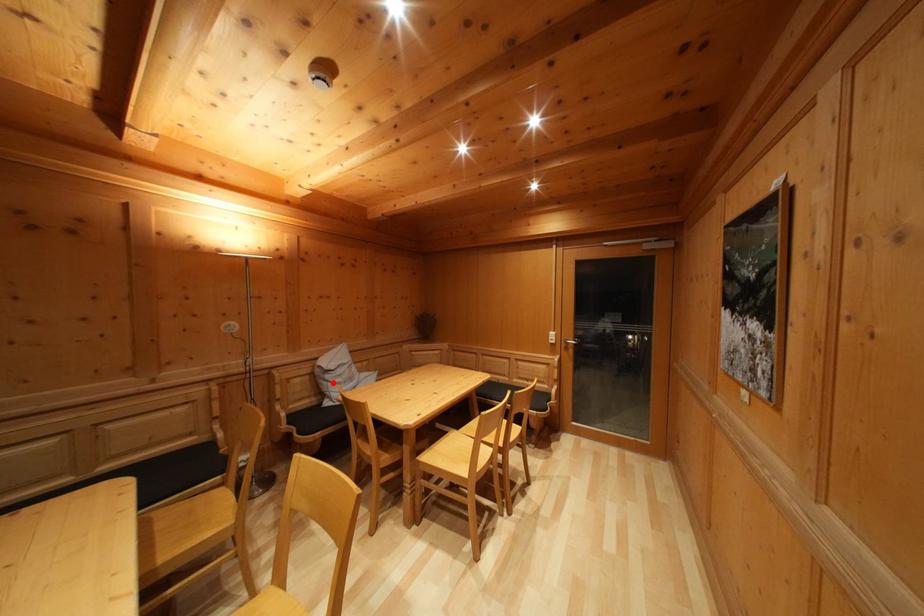
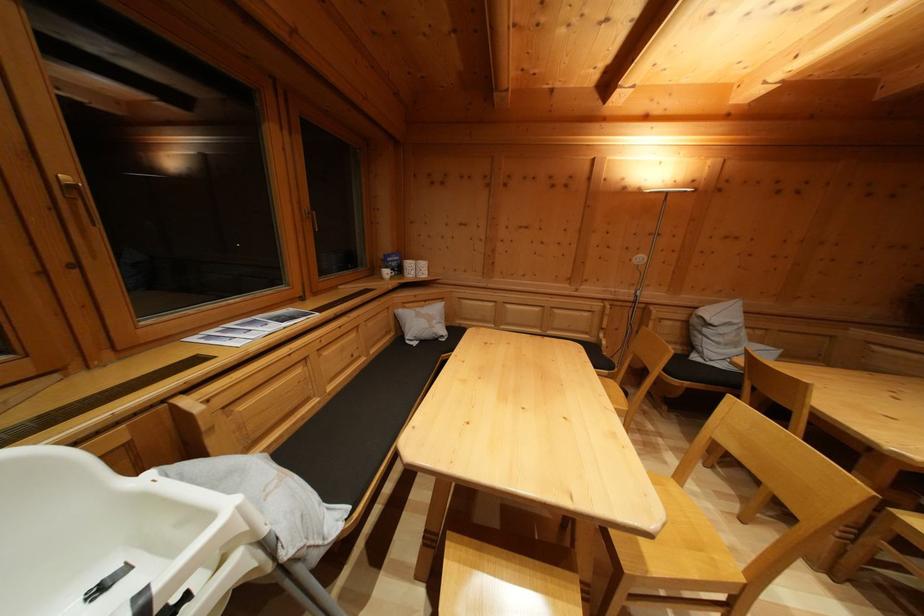
In the second image, find the point that corresponds to the highlighted location in the first image.

(711, 337)